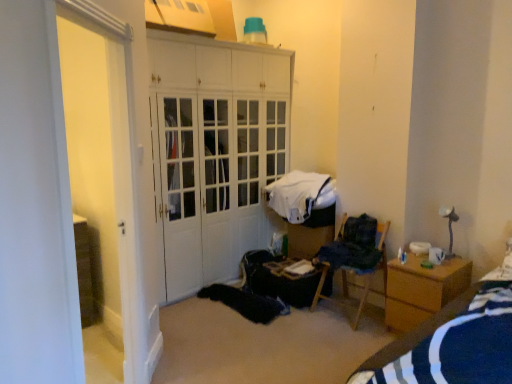
Find the location of a particular element. This screenshot has width=512, height=384. vacant region in front of white glossy cabinet at center is located at coordinates (237, 333).